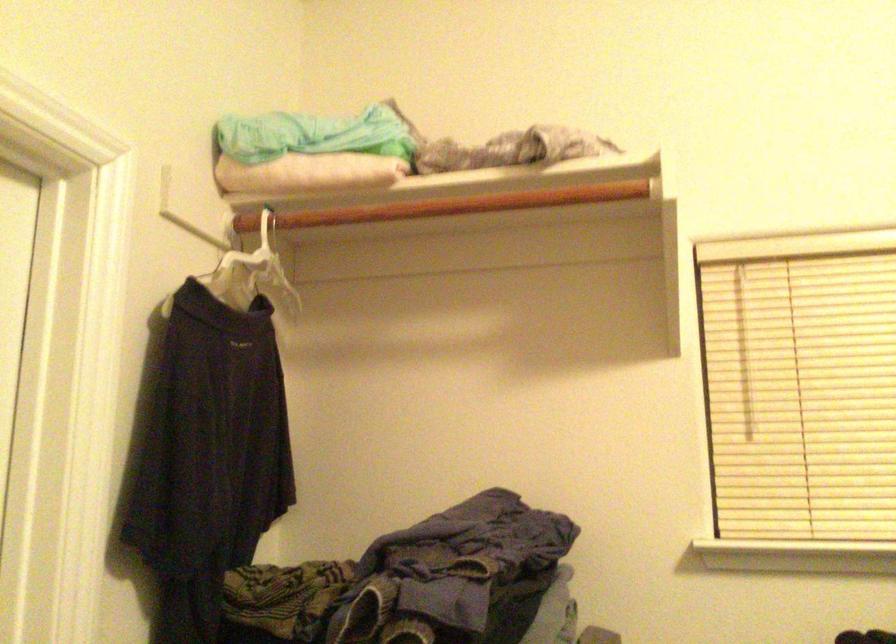
The image size is (896, 644). Identify the location of blind pull cord. (743, 352).